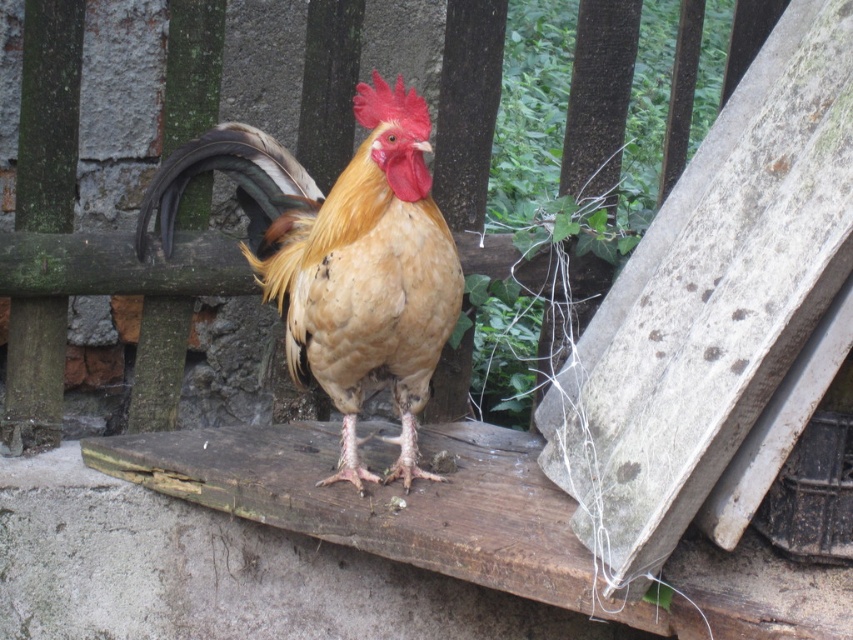
Consider the image. Does golden feathered rooster at center appear over wooden at center?

No, golden feathered rooster at center is not above wooden at center.

Can you confirm if golden feathered rooster at center is shorter than wooden at center?

Indeed, golden feathered rooster at center has a lesser height compared to wooden at center.

The height and width of the screenshot is (640, 853). What are the coordinates of `golden feathered rooster at center` in the screenshot? It's located at (341, 259).

What are the coordinates of `golden feathered rooster at center` in the screenshot? It's located at (341, 259).